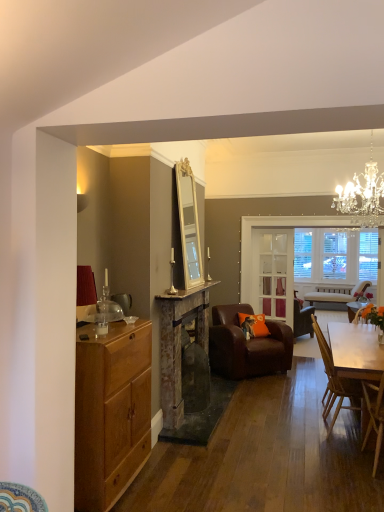
Question: Can you confirm if wooden chair at lower right, the first chair in the front-to-back sequence, is bigger than clear glass door at center?

Choices:
 (A) yes
 (B) no

Answer: (A)

Question: Does wooden chair at lower right, the first chair in the front-to-back sequence, have a greater width compared to clear glass door at center?

Choices:
 (A) yes
 (B) no

Answer: (A)

Question: Can you confirm if wooden chair at lower right, the first chair in the front-to-back sequence, is positioned to the left of clear glass door at center?

Choices:
 (A) yes
 (B) no

Answer: (B)

Question: Is wooden chair at lower right, which is the 3th chair from back to front, outside clear glass door at center?

Choices:
 (A) yes
 (B) no

Answer: (A)

Question: Can you confirm if wooden chair at lower right, the first chair in the front-to-back sequence, is taller than clear glass door at center?

Choices:
 (A) no
 (B) yes

Answer: (A)

Question: Looking at the image, does wooden chair at right, placed as the 2th chair when sorted from back to front, seem bigger or smaller compared to wooden chair at lower right, which is the 3th chair from back to front?

Choices:
 (A) big
 (B) small

Answer: (A)

Question: Would you say wooden chair at right, marked as the second chair in a front-to-back arrangement, is inside or outside wooden chair at lower right, the first chair in the front-to-back sequence?

Choices:
 (A) outside
 (B) inside

Answer: (A)

Question: From a real-world perspective, is wooden chair at right, marked as the second chair in a front-to-back arrangement, physically located above or below wooden chair at lower right, the first chair in the front-to-back sequence?

Choices:
 (A) above
 (B) below

Answer: (B)

Question: From their relative heights in the image, would you say wooden chair at right, marked as the second chair in a front-to-back arrangement, is taller or shorter than wooden chair at lower right, the first chair in the front-to-back sequence?

Choices:
 (A) short
 (B) tall

Answer: (B)

Question: Is brown leather armchair at center, which is counted as the first chair, starting from the back, inside or outside of light brown wood cabinet at left?

Choices:
 (A) outside
 (B) inside

Answer: (A)

Question: Looking at their shapes, would you say brown leather armchair at center, the 3th chair viewed from the front, is wider or thinner than light brown wood cabinet at left?

Choices:
 (A) thin
 (B) wide

Answer: (B)

Question: Based on their sizes in the image, would you say brown leather armchair at center, the 3th chair viewed from the front, is bigger or smaller than light brown wood cabinet at left?

Choices:
 (A) big
 (B) small

Answer: (A)

Question: From their relative heights in the image, would you say brown leather armchair at center, the 3th chair viewed from the front, is taller or shorter than light brown wood cabinet at left?

Choices:
 (A) tall
 (B) short

Answer: (B)

Question: Is rustic stone fireplace at center inside or outside of wooden chair at right, placed as the 2th chair when sorted from back to front?

Choices:
 (A) inside
 (B) outside

Answer: (B)

Question: From a real-world perspective, is rustic stone fireplace at center above or below wooden chair at right, marked as the second chair in a front-to-back arrangement?

Choices:
 (A) above
 (B) below

Answer: (A)